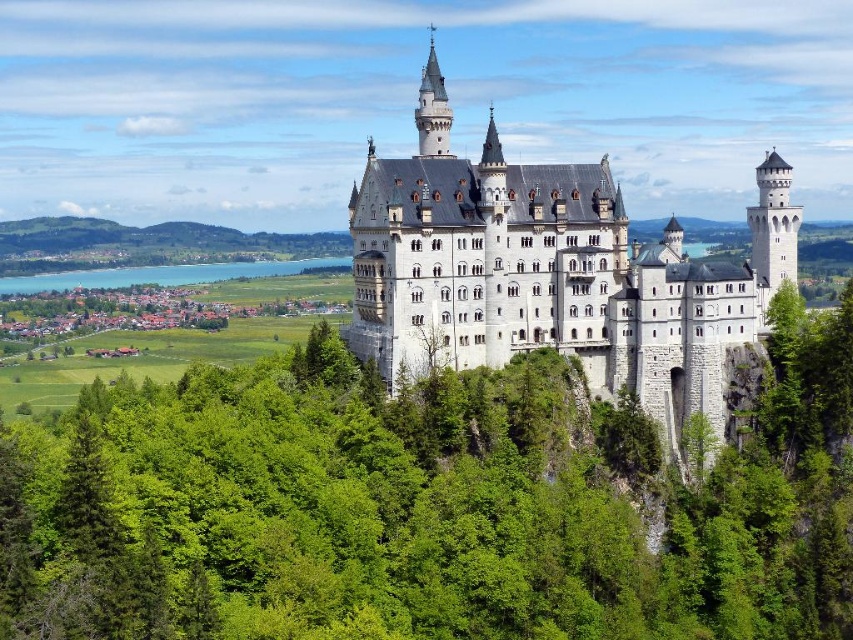
Question: Which object is farther from the camera taking this photo?

Choices:
 (A) white stone castle at center
 (B) turquoise glassy water at lower left

Answer: (B)

Question: Does green leafy tree at center appear under white stone castle at center?

Choices:
 (A) no
 (B) yes

Answer: (B)

Question: Does white stone castle at center appear on the left side of turquoise glassy water at lower left?

Choices:
 (A) no
 (B) yes

Answer: (A)

Question: Which object appears farthest from the camera in this image?

Choices:
 (A) green leafy tree at center
 (B) white stone castle at center

Answer: (B)

Question: Does white stone castle at center appear on the left side of turquoise glassy water at lower left?

Choices:
 (A) no
 (B) yes

Answer: (A)

Question: Among these points, which one is nearest to the camera?

Choices:
 (A) (x=650, y=323)
 (B) (x=173, y=518)
 (C) (x=28, y=289)

Answer: (B)